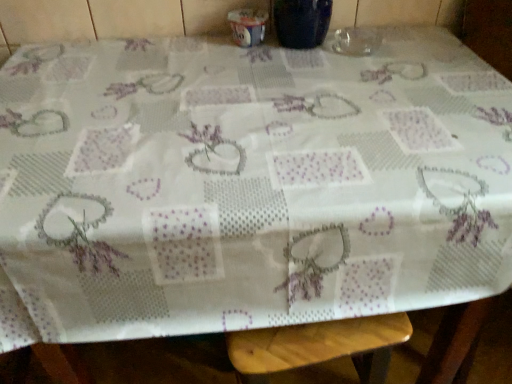
Locate an element on the screen. free spot to the left of matte dark blue glass vase at upper center is located at coordinates (208, 48).